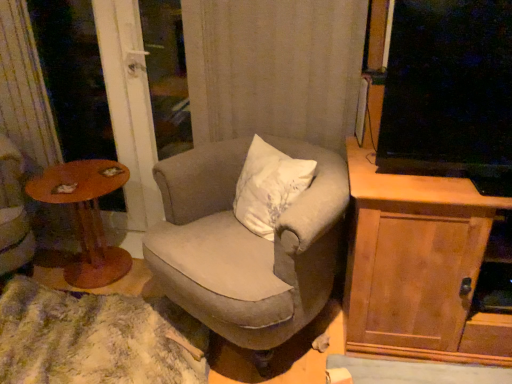
Question: Can you see textured beige armchair at center touching transparent glass screen door at left?

Choices:
 (A) yes
 (B) no

Answer: (B)

Question: Can you confirm if textured beige armchair at center is bigger than transparent glass screen door at left?

Choices:
 (A) no
 (B) yes

Answer: (B)

Question: Can you confirm if textured beige armchair at center is wider than transparent glass screen door at left?

Choices:
 (A) no
 (B) yes

Answer: (B)

Question: From the image's perspective, is textured beige armchair at center over transparent glass screen door at left?

Choices:
 (A) no
 (B) yes

Answer: (A)

Question: Can you confirm if textured beige armchair at center is taller than transparent glass screen door at left?

Choices:
 (A) yes
 (B) no

Answer: (B)

Question: Does textured beige armchair at center lie in front of transparent glass screen door at left?

Choices:
 (A) yes
 (B) no

Answer: (A)

Question: Is wooden cabinet at right completely or partially inside wooden round table at left?

Choices:
 (A) no
 (B) yes

Answer: (A)

Question: Considering the relative positions of wooden round table at left and wooden cabinet at right in the image provided, is wooden round table at left behind wooden cabinet at right?

Choices:
 (A) yes
 (B) no

Answer: (A)

Question: Is wooden round table at left bigger than wooden cabinet at right?

Choices:
 (A) yes
 (B) no

Answer: (B)

Question: From a real-world perspective, does wooden round table at left sit lower than wooden cabinet at right?

Choices:
 (A) yes
 (B) no

Answer: (A)

Question: Is wooden round table at left aimed at wooden cabinet at right?

Choices:
 (A) yes
 (B) no

Answer: (B)

Question: Can you confirm if wooden round table at left is wider than wooden cabinet at right?

Choices:
 (A) yes
 (B) no

Answer: (B)

Question: Does wooden round table at left turn towards textured beige armchair at center?

Choices:
 (A) no
 (B) yes

Answer: (A)